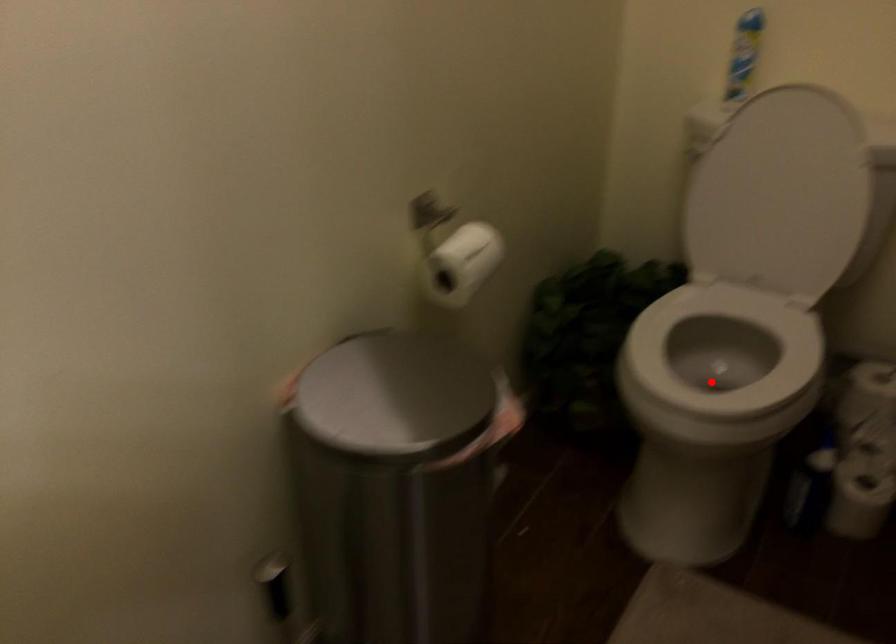
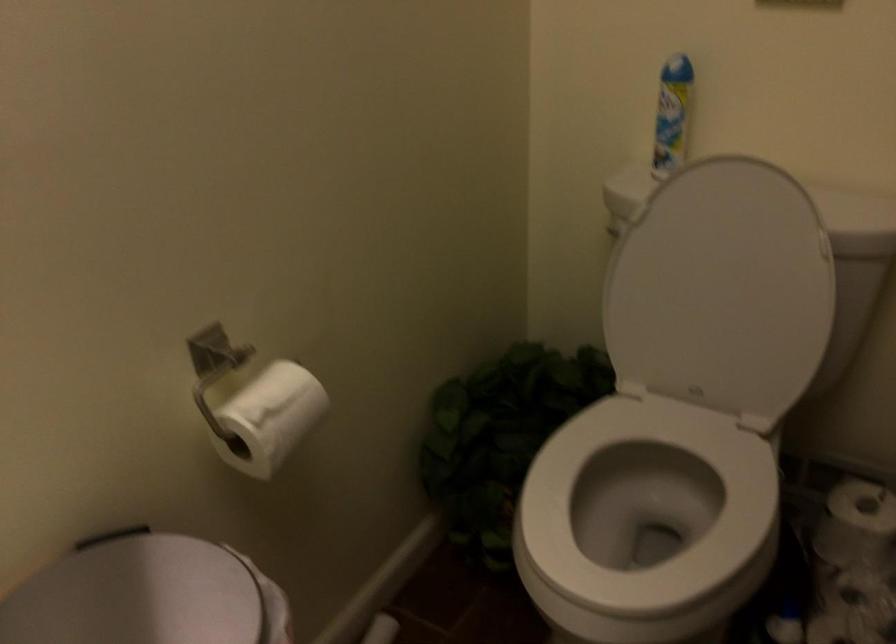
The point at the highlighted location is marked in the first image. Where is the corresponding point in the second image?

(645, 516)